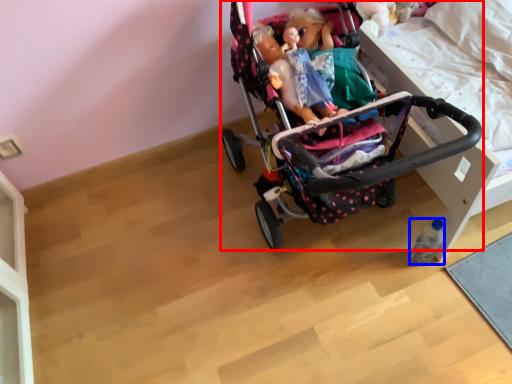
Question: Which object is closer to the camera taking this photo, stroller (highlighted by a red box) or bottle (highlighted by a blue box)?

Choices:
 (A) stroller
 (B) bottle

Answer: (A)